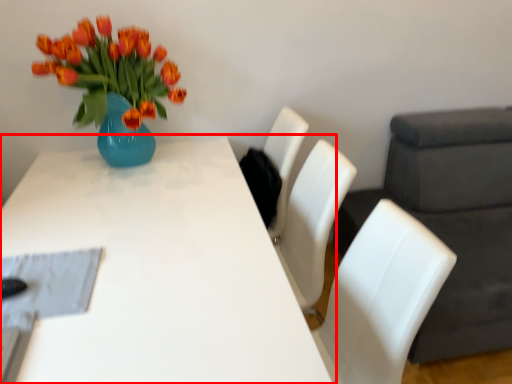
Question: In this image, where is table (annotated by the red box) located relative to swivel chair?

Choices:
 (A) right
 (B) left

Answer: (B)